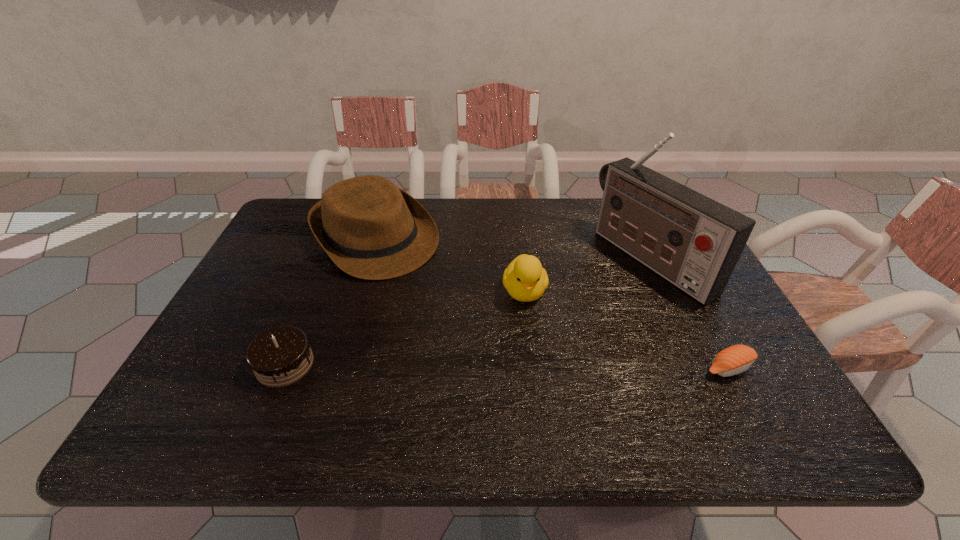
Image resolution: width=960 pixels, height=540 pixels. In order to click on free space on the desktop that is between the fourth tallest object and the sushi and is positioned on the front-facing side of the fedora in this screenshot , I will do `click(502, 366)`.

Where is `vacant space on the desktop that is between the chocolate cake and the sushi and is positioned on the front-facing side of the duck`? This screenshot has width=960, height=540. vacant space on the desktop that is between the chocolate cake and the sushi and is positioned on the front-facing side of the duck is located at coordinates (538, 366).

At what (x,y) coordinates should I click in order to perform the action: click on vacant spot on the desktop that is between the second shortest object and the shortest object and is positioned on the front panel of the radio receiver. Please return your answer as a coordinate pair (x, y). Image resolution: width=960 pixels, height=540 pixels. Looking at the image, I should click on (444, 366).